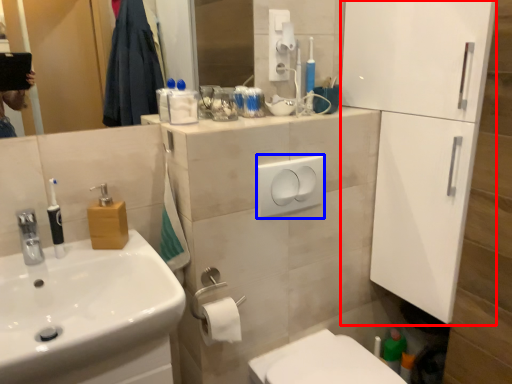
Question: Which point is closer to the camera, screen door (highlighted by a red box) or light switch (highlighted by a blue box)?

Choices:
 (A) screen door
 (B) light switch

Answer: (A)